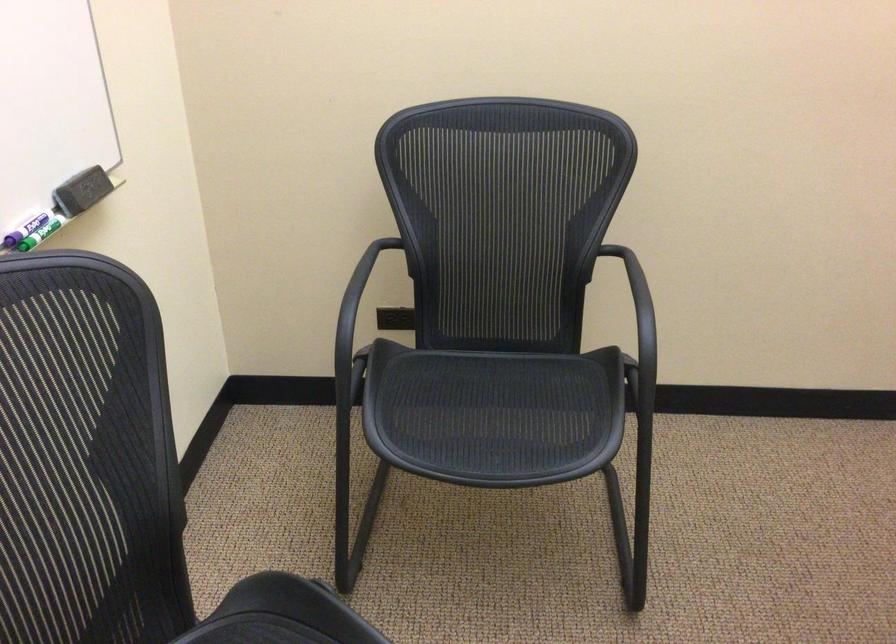
Where is `chair sitting surface`? The image size is (896, 644). chair sitting surface is located at coordinates (478, 413).